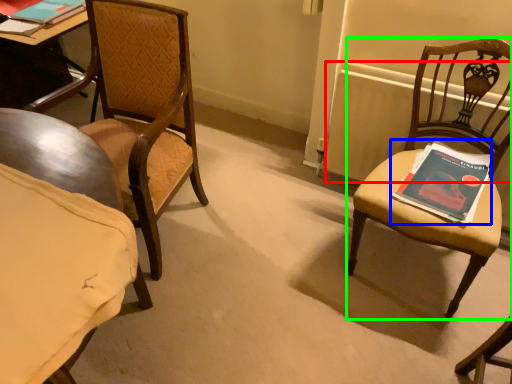
Question: Which object is positioned farthest from radiator (highlighted by a red box)? Select from book (highlighted by a blue box) and chair (highlighted by a green box).

Choices:
 (A) book
 (B) chair

Answer: (A)